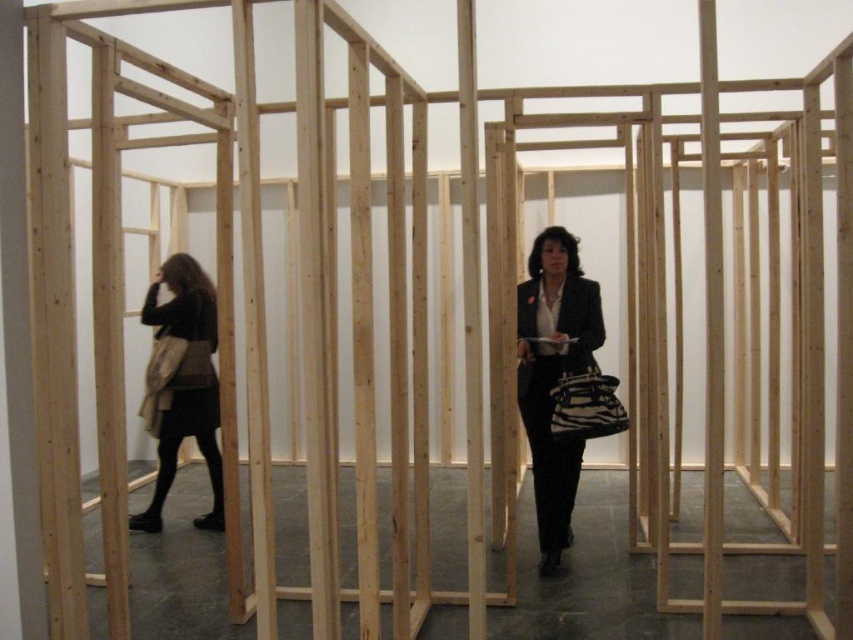
Is matte black blazer at center in front of matte black coat at left?

Yes, it is.

Between matte black blazer at center and matte black coat at left, which one appears on the right side from the viewer's perspective?

matte black blazer at center

What do you see at coordinates (553, 376) in the screenshot?
I see `matte black blazer at center` at bounding box center [553, 376].

The image size is (853, 640). I want to click on matte black blazer at center, so click(553, 376).